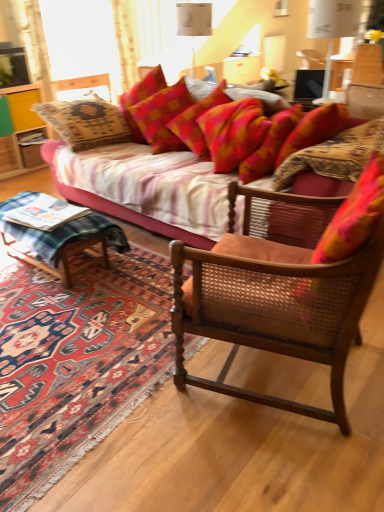
Question: Is yellow wood cabinet at left positioned with its back to wooden cane chair at center?

Choices:
 (A) yes
 (B) no

Answer: (B)

Question: Is yellow wood cabinet at left not within wooden cane chair at center?

Choices:
 (A) yes
 (B) no

Answer: (A)

Question: Can you confirm if yellow wood cabinet at left is positioned to the right of wooden cane chair at center?

Choices:
 (A) yes
 (B) no

Answer: (B)

Question: From a real-world perspective, is yellow wood cabinet at left physically above wooden cane chair at center?

Choices:
 (A) yes
 (B) no

Answer: (B)

Question: Does yellow wood cabinet at left have a greater width compared to wooden cane chair at center?

Choices:
 (A) no
 (B) yes

Answer: (A)

Question: From the image's perspective, is yellow wood cabinet at left on wooden cane chair at center?

Choices:
 (A) yes
 (B) no

Answer: (A)

Question: Is wooden cane chair at center further to camera compared to yellow wood cabinet at left?

Choices:
 (A) no
 (B) yes

Answer: (A)

Question: Can you confirm if wooden cane chair at center is bigger than yellow wood cabinet at left?

Choices:
 (A) yes
 (B) no

Answer: (A)

Question: Can you confirm if wooden cane chair at center is taller than yellow wood cabinet at left?

Choices:
 (A) yes
 (B) no

Answer: (A)

Question: From a real-world perspective, is wooden cane chair at center positioned under yellow wood cabinet at left based on gravity?

Choices:
 (A) yes
 (B) no

Answer: (B)

Question: From the image's perspective, is wooden cane chair at center located above yellow wood cabinet at left?

Choices:
 (A) yes
 (B) no

Answer: (B)

Question: Does wooden cane chair at center have a lesser width compared to yellow wood cabinet at left?

Choices:
 (A) yes
 (B) no

Answer: (B)

Question: From the image's perspective, does textured fabric couch at center appear lower than carpeted rug at lower left?

Choices:
 (A) no
 (B) yes

Answer: (A)